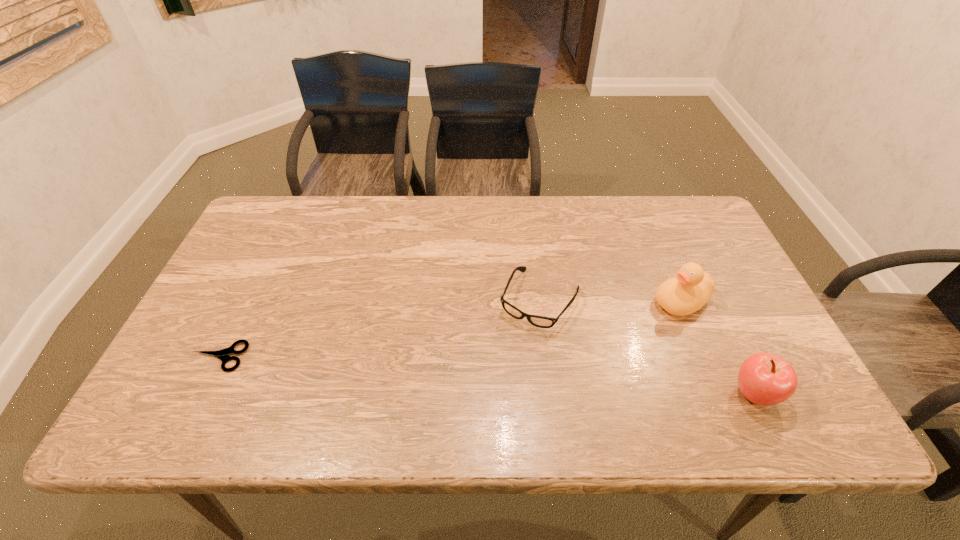
Image resolution: width=960 pixels, height=540 pixels. In order to click on free space located 0.120m on the face of the duck in this screenshot , I will do `click(623, 329)`.

Find the location of a particular element. The width and height of the screenshot is (960, 540). vacant region located on the front-facing side of the spectacles is located at coordinates (490, 390).

The image size is (960, 540). What are the coordinates of `free region located 0.120m on the front-facing side of the spectacles` in the screenshot? It's located at (x=503, y=366).

Find the location of a particular element. Image resolution: width=960 pixels, height=540 pixels. vacant space situated 0.110m on the front-facing side of the spectacles is located at coordinates (505, 363).

I want to click on shears that is at the near edge, so click(221, 354).

The width and height of the screenshot is (960, 540). What are the coordinates of `apple present at the near edge` in the screenshot? It's located at (765, 379).

In order to click on object positioned at the left edge in this screenshot , I will do `click(221, 354)`.

Where is `apple that is at the right edge`? Image resolution: width=960 pixels, height=540 pixels. apple that is at the right edge is located at coordinates (765, 379).

In order to click on duck positioned at the right edge in this screenshot , I will do `click(691, 288)`.

At what (x,y) coordinates should I click in order to perform the action: click on object that is positioned at the near left corner. Please return your answer as a coordinate pair (x, y). This screenshot has height=540, width=960. Looking at the image, I should click on (221, 354).